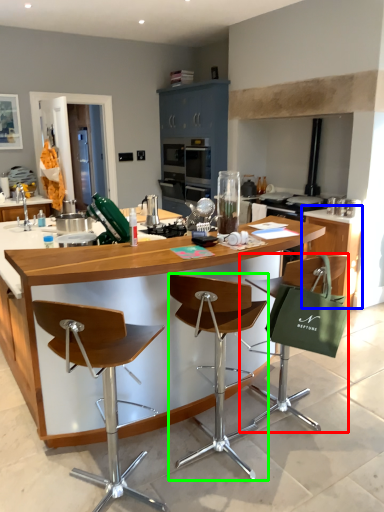
Question: Considering the real-world distances, which object is farthest from chair (highlighted by a red box)? cabinetry (highlighted by a blue box) or chair (highlighted by a green box)?

Choices:
 (A) cabinetry
 (B) chair

Answer: (A)